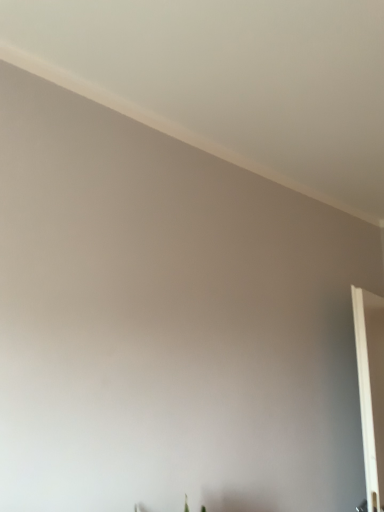
What do you see at coordinates (371, 388) in the screenshot? I see `clear glass door at right` at bounding box center [371, 388].

Identify the location of clear glass door at right. This screenshot has width=384, height=512. (371, 388).

The image size is (384, 512). I want to click on clear glass door at right, so click(x=371, y=388).